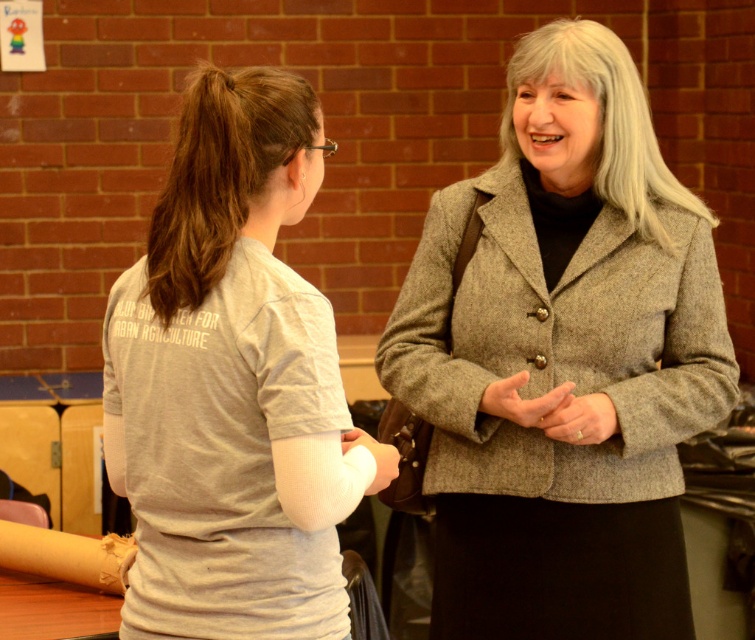
Question: Does matte gray blazer at center appear over gray cotton t-shirt at center?

Choices:
 (A) no
 (B) yes

Answer: (B)

Question: Considering the relative positions of matte gray blazer at center and gray cotton t-shirt at center in the image provided, where is matte gray blazer at center located with respect to gray cotton t-shirt at center?

Choices:
 (A) below
 (B) above

Answer: (B)

Question: Which point appears farthest from the camera in this image?

Choices:
 (A) (248, 196)
 (B) (700, 344)

Answer: (B)

Question: Does matte gray blazer at center have a larger size compared to gray cotton t-shirt at center?

Choices:
 (A) no
 (B) yes

Answer: (B)